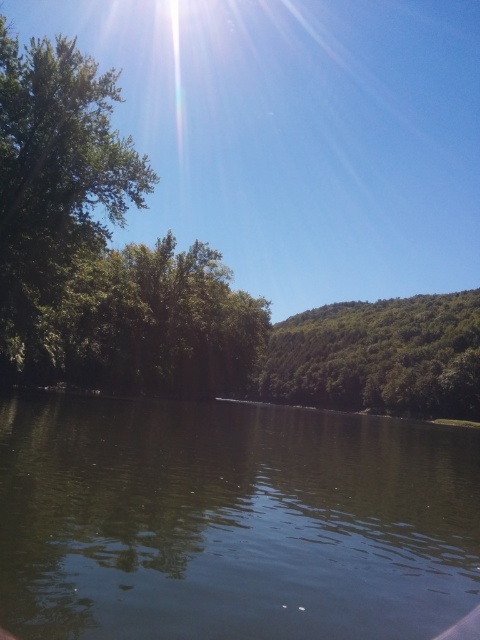
Question: Can you confirm if green reflective water at center is thinner than green leafy tree at left?

Choices:
 (A) yes
 (B) no

Answer: (A)

Question: Which point is farther to the camera?

Choices:
 (A) green reflective water at center
 (B) green leafy hillside at center

Answer: (B)

Question: Can you confirm if green reflective water at center is positioned to the left of green leafy hillside at center?

Choices:
 (A) no
 (B) yes

Answer: (B)

Question: Which point is farther to the camera?

Choices:
 (A) (288, 380)
 (B) (54, 465)

Answer: (A)

Question: Among these points, which one is nearest to the camera?

Choices:
 (A) (288, 392)
 (B) (3, 353)

Answer: (B)

Question: Does green leafy tree at left appear on the left side of green leafy hillside at center?

Choices:
 (A) yes
 (B) no

Answer: (A)